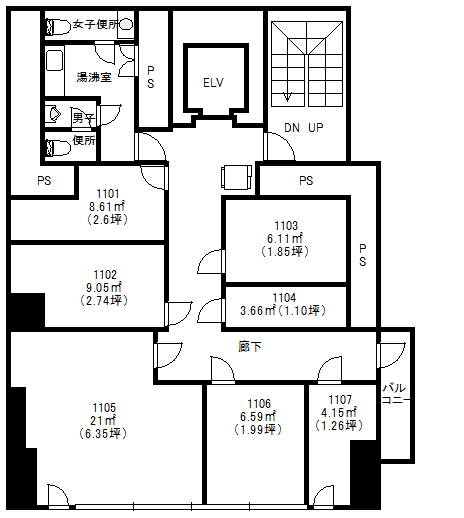
Where is `elevator`? elevator is located at coordinates (215, 86).